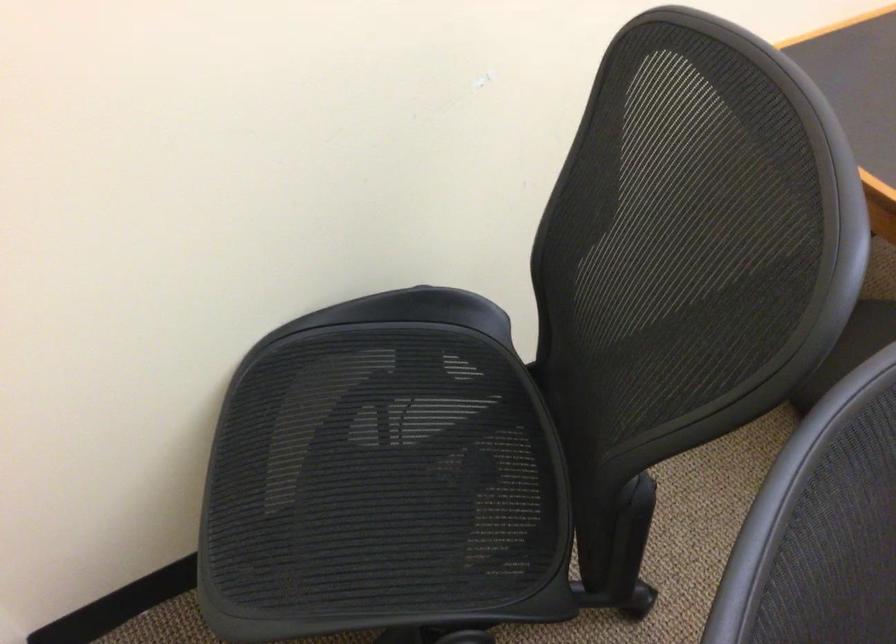
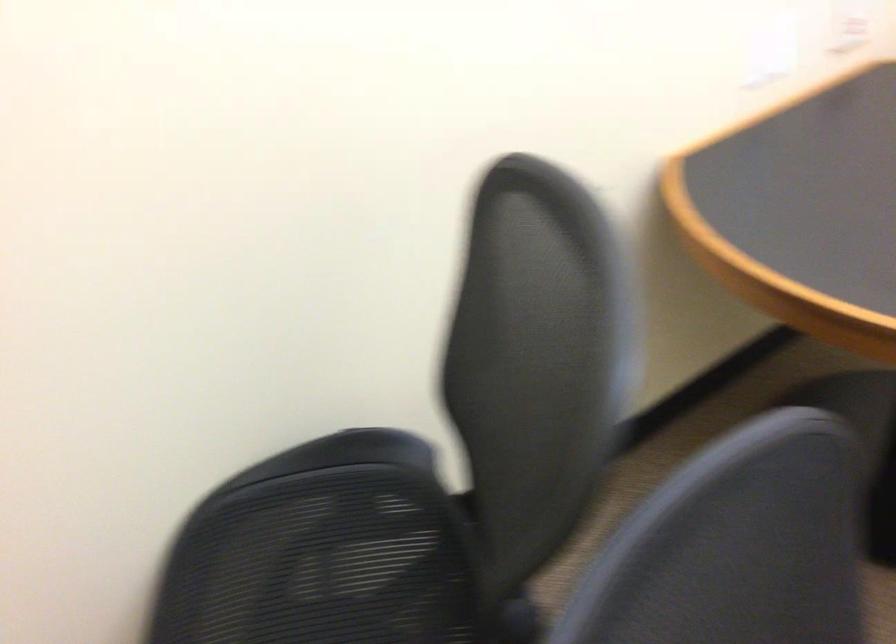
Question: The images are taken continuously from a first-person perspective. In which direction are you moving?

Choices:
 (A) Left
 (B) Right
 (C) Forward
 (D) Backward

Answer: (B)